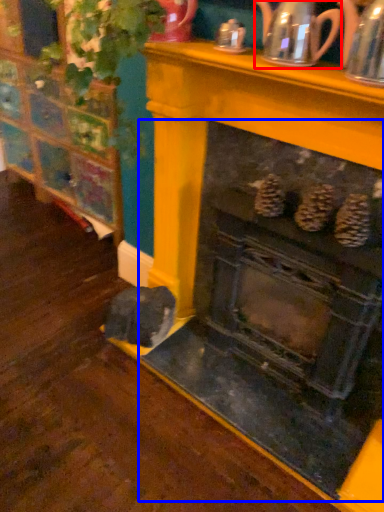
Question: Which point is closer to the camera, tea pot (highlighted by a red box) or fireplace (highlighted by a blue box)?

Choices:
 (A) tea pot
 (B) fireplace

Answer: (B)